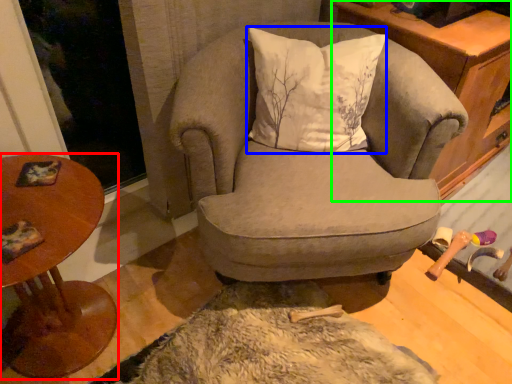
Question: Considering the real-world distances, which object is farthest from table (highlighted by a red box)? pillow (highlighted by a blue box) or cabinetry (highlighted by a green box)?

Choices:
 (A) pillow
 (B) cabinetry

Answer: (B)